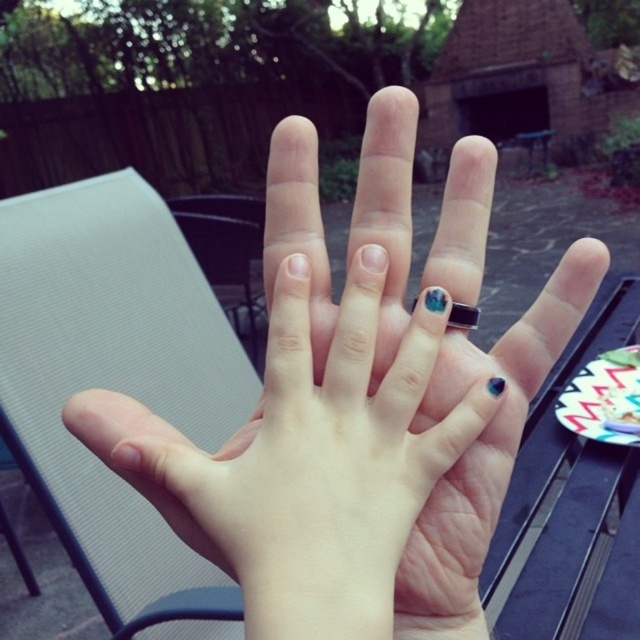
You are an artist trying to paint a miniature scene on the nail polish at center. The scene must include the blue gemstone ring at center. Since you need to focus on the ring, which object should you adjust your focus to first?

The nail polish at center is closer to the viewer than the blue gemstone ring at center, so you should adjust your focus to the nail polish at center first to ensure proper alignment before incorporating the ring into the scene.